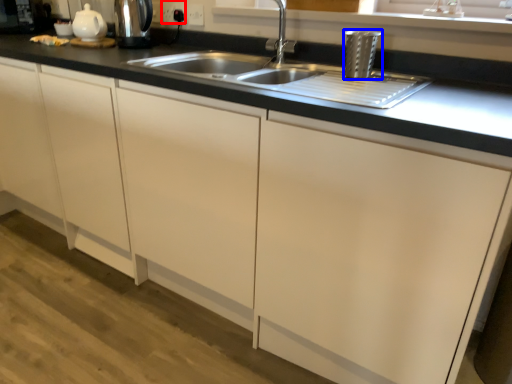
Question: Among these objects, which one is nearest to the camera, electric outlet (highlighted by a red box) or appliance (highlighted by a blue box)?

Choices:
 (A) electric outlet
 (B) appliance

Answer: (B)